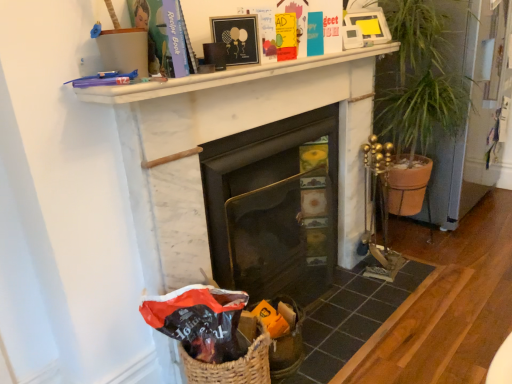
Question: Should I look upward or downward to see matte black gift bag at lower left?

Choices:
 (A) up
 (B) down

Answer: (B)

Question: Is white marble fireplace at center, the first fireplace in the right-to-left sequence, at the right side of white marble fireplace at upper center?

Choices:
 (A) yes
 (B) no

Answer: (A)

Question: Does white marble fireplace at center, the first fireplace in the right-to-left sequence, lie behind white marble fireplace at upper center?

Choices:
 (A) yes
 (B) no

Answer: (A)

Question: Is white marble fireplace at center, the first fireplace in the right-to-left sequence, in contact with white marble fireplace at upper center?

Choices:
 (A) no
 (B) yes

Answer: (A)

Question: Can you confirm if white marble fireplace at center, the first fireplace in the right-to-left sequence, is bigger than white marble fireplace at upper center?

Choices:
 (A) yes
 (B) no

Answer: (A)

Question: From the image's perspective, does white marble fireplace at center, which is the 2th fireplace in left-to-right order, appear lower than white marble fireplace at upper center?

Choices:
 (A) yes
 (B) no

Answer: (A)

Question: Considering the relative sizes of white marble fireplace at center, which is the 2th fireplace in left-to-right order, and white marble fireplace at upper center in the image provided, is white marble fireplace at center, which is the 2th fireplace in left-to-right order, smaller than white marble fireplace at upper center?

Choices:
 (A) yes
 (B) no

Answer: (B)

Question: Could you tell me if matte black gift bag at lower left is facing white marble fireplace at center, which is the 2th fireplace in left-to-right order?

Choices:
 (A) no
 (B) yes

Answer: (A)

Question: Considering the relative sizes of matte black gift bag at lower left and white marble fireplace at center, which is the 2th fireplace in left-to-right order, in the image provided, is matte black gift bag at lower left wider than white marble fireplace at center, which is the 2th fireplace in left-to-right order,?

Choices:
 (A) yes
 (B) no

Answer: (A)

Question: Considering the relative sizes of matte black gift bag at lower left and white marble fireplace at center, the first fireplace in the right-to-left sequence, in the image provided, is matte black gift bag at lower left taller than white marble fireplace at center, the first fireplace in the right-to-left sequence,?

Choices:
 (A) no
 (B) yes

Answer: (A)

Question: Does matte black gift bag at lower left have a smaller size compared to white marble fireplace at center, the first fireplace in the right-to-left sequence?

Choices:
 (A) no
 (B) yes

Answer: (B)

Question: Does matte black gift bag at lower left appear on the right side of white marble fireplace at center, which is the 2th fireplace in left-to-right order?

Choices:
 (A) no
 (B) yes

Answer: (A)

Question: Is matte black gift bag at lower left positioned behind white marble fireplace at center, which is the 2th fireplace in left-to-right order?

Choices:
 (A) no
 (B) yes

Answer: (A)

Question: Is the depth of green leafy plant at right greater than that of black glass fireplace at center, positioned as the 2th fireplace in right-to-left order?

Choices:
 (A) yes
 (B) no

Answer: (A)